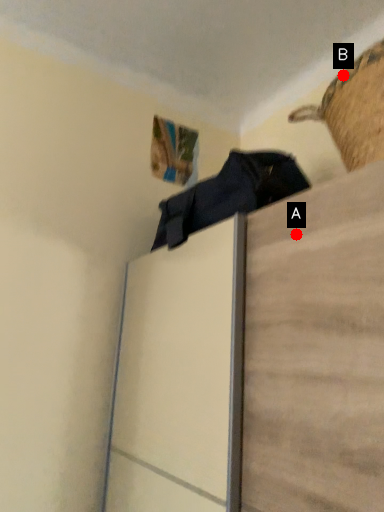
Question: Two points are circled on the image, labeled by A and B beside each circle. Which point appears closest to the camera in this image?

Choices:
 (A) A is closer
 (B) B is closer

Answer: (A)